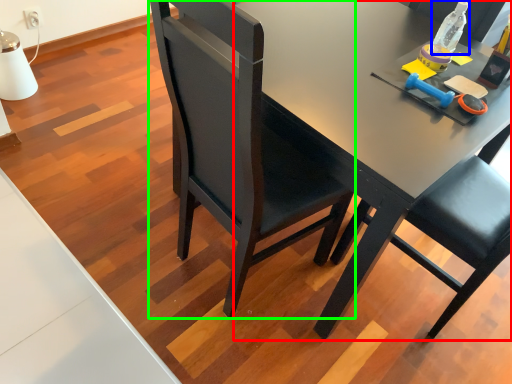
Question: Estimate the real-world distances between objects in this image. Which object is closer to desk (highlighted by a red box), bottle (highlighted by a blue box) or chair (highlighted by a green box)?

Choices:
 (A) bottle
 (B) chair

Answer: (B)